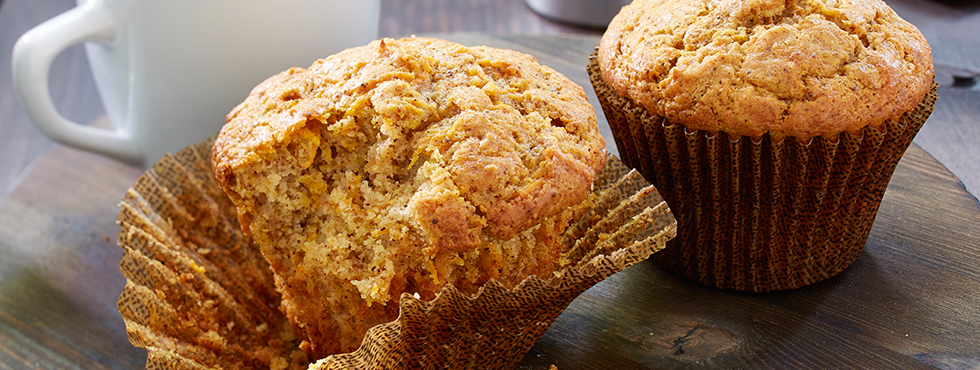
The width and height of the screenshot is (980, 370). What are the coordinates of `wood tabletop` in the screenshot? It's located at (450, 7).